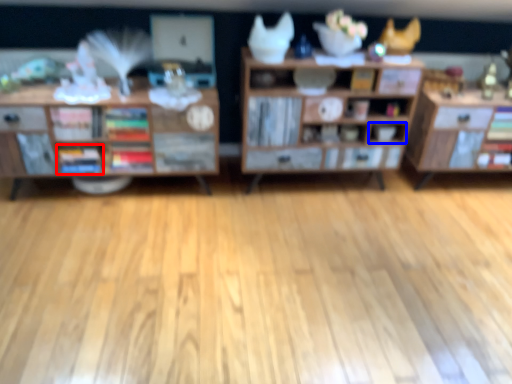
Question: Among these objects, which one is nearest to the camera, book (highlighted by a red box) or cabinet (highlighted by a blue box)?

Choices:
 (A) book
 (B) cabinet

Answer: (A)